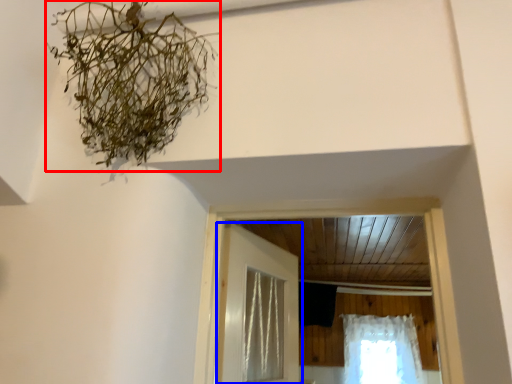
Question: Which object appears closest to the camera in this image, plant (highlighted by a red box) or door (highlighted by a blue box)?

Choices:
 (A) plant
 (B) door

Answer: (A)